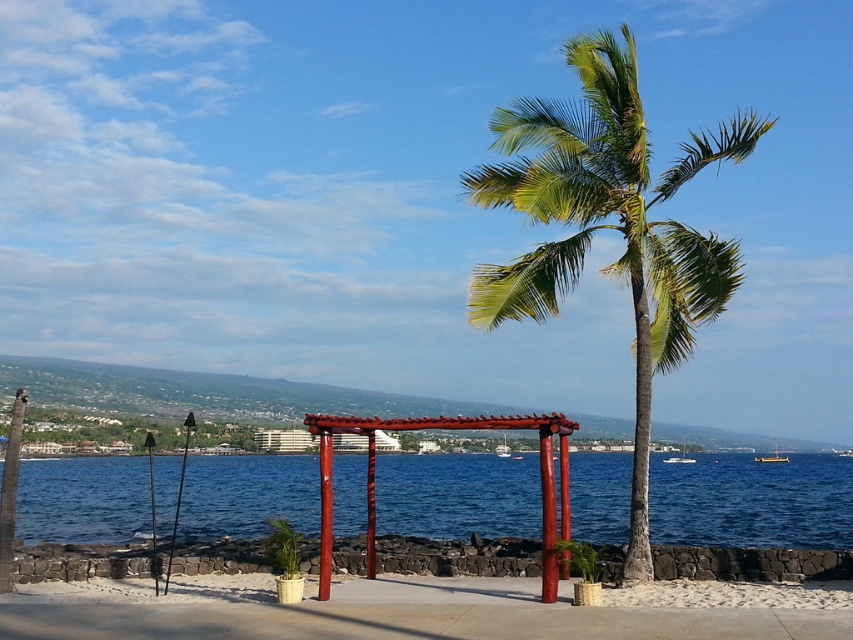
Can you confirm if blue water at center is thinner than green leafy palm tree at center?

Incorrect, blue water at center's width is not less than green leafy palm tree at center's.

How distant is blue water at center from green leafy palm tree at center?

blue water at center and green leafy palm tree at center are 25.70 meters apart.

Where is `blue water at center`? This screenshot has height=640, width=853. blue water at center is located at coordinates [752, 500].

Where is `blue water at center`? blue water at center is located at coordinates (752, 500).

Is point (86, 515) in front of point (193, 616)?

No, it is behind (193, 616).

Identify the location of blue water at center. The width and height of the screenshot is (853, 640). (752, 500).

The image size is (853, 640). Find the location of `blue water at center`. blue water at center is located at coordinates (752, 500).

Which is above, green leafy palm tree at center or white sand at lower center?

green leafy palm tree at center is above.

Which is behind, point (636, 456) or point (341, 625)?

The point (636, 456) is more distant.

Identify the location of green leafy palm tree at center. (607, 227).